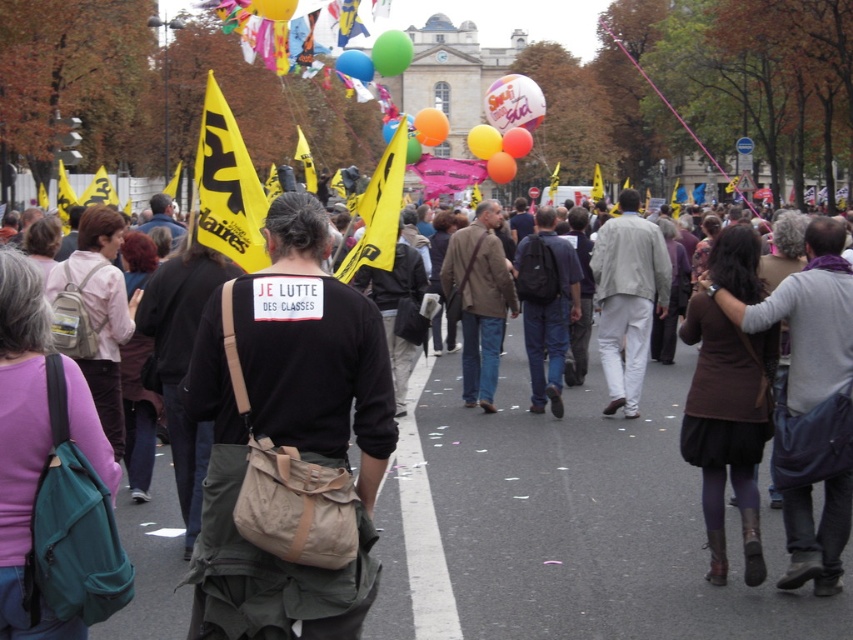
Question: Which of the following is the closest to the observer?

Choices:
 (A) yellow rubber balloon at center
 (B) orange matte balloon at center

Answer: (A)

Question: Considering the real-world distances, which object is closest to the matte blue balloon at upper center?

Choices:
 (A) yellow rubber balloon at center
 (B) orange matte balloon at center
 (C) dark green canvas bag at center

Answer: (B)

Question: Among these points, which one is nearest to the camera?

Choices:
 (A) (532, 83)
 (B) (480, 141)
 (C) (383, 76)
 (D) (625, 545)

Answer: (D)

Question: Can you confirm if dark green canvas bag at center is positioned to the right of matte white balloon at center?

Choices:
 (A) no
 (B) yes

Answer: (A)

Question: Does dark brown leather jacket at center appear on the right side of white glossy balloon at center?

Choices:
 (A) no
 (B) yes

Answer: (A)

Question: Is green rubber balloon at center above orange matte balloon at center?

Choices:
 (A) no
 (B) yes

Answer: (B)